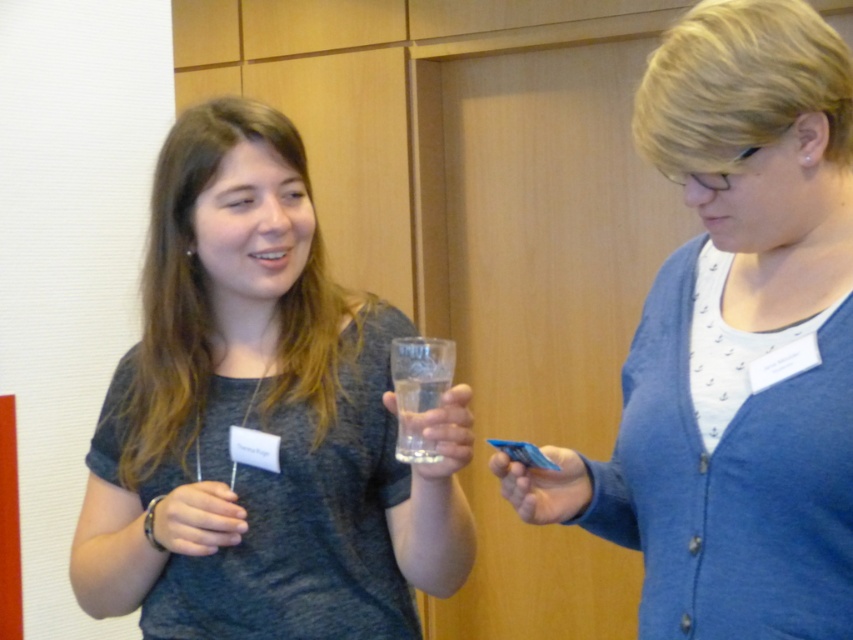
Question: Is matte gray shirt at center below matte gray wristband at lower left?

Choices:
 (A) yes
 (B) no

Answer: (B)

Question: Which object appears closest to the camera in this image?

Choices:
 (A) matte gray shirt at center
 (B) blue card at center
 (C) matte gray wristband at lower left

Answer: (B)

Question: Which point is closer to the camera?

Choices:
 (A) blue plastic card at center
 (B) blue card at center
 (C) matte gray shirt at center
 (D) matte gray wristband at lower left

Answer: (B)

Question: Is blue card at center smaller than matte gray wristband at lower left?

Choices:
 (A) no
 (B) yes

Answer: (A)

Question: Does matte gray wristband at lower left lie behind transparent glass at center?

Choices:
 (A) no
 (B) yes

Answer: (B)

Question: Which of the following is the closest to the observer?

Choices:
 (A) transparent glass at center
 (B) blue plastic card at center
 (C) blue card at center
 (D) matte gray wristband at lower left

Answer: (C)